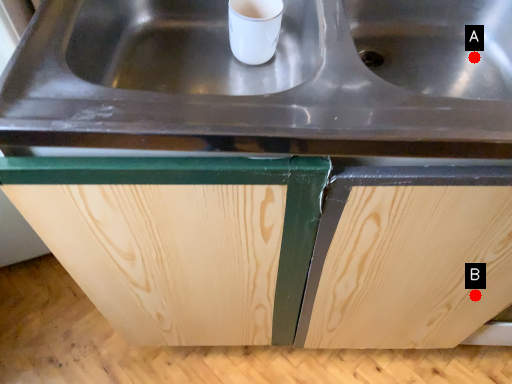
Question: Two points are circled on the image, labeled by A and B beside each circle. Which point is farther from the camera taking this photo?

Choices:
 (A) A is further
 (B) B is further

Answer: (A)